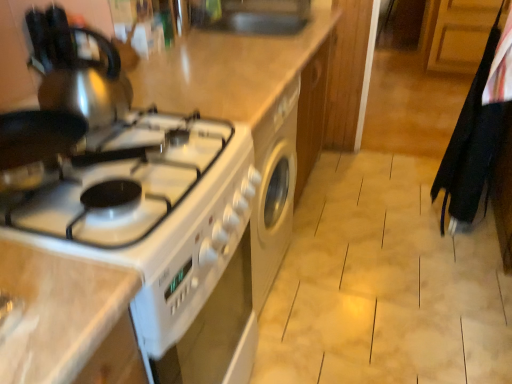
The height and width of the screenshot is (384, 512). What do you see at coordinates (103, 174) in the screenshot?
I see `white glossy gas stove at left` at bounding box center [103, 174].

The width and height of the screenshot is (512, 384). What do you see at coordinates (250, 107) in the screenshot?
I see `white glossy stove at left` at bounding box center [250, 107].

I want to click on white glossy gas stove at left, so click(103, 174).

Is black fabric laundry at right oriented away from white glossy gas stove at left?

No, black fabric laundry at right is not facing the opposite direction of white glossy gas stove at left.

Is black fabric laundry at right behind white glossy gas stove at left?

Yes, black fabric laundry at right is behind white glossy gas stove at left.

From a real-world perspective, which object stands above the other?

white glossy gas stove at left.

Consider the image. Is black fabric laundry at right inside the boundaries of white glossy gas stove at left, or outside?

black fabric laundry at right is not inside white glossy gas stove at left, it's outside.

Considering the positions of point (47, 104) and point (168, 118), is point (47, 104) closer or farther from the camera than point (168, 118)?

Clearly, point (47, 104) is closer to the camera than point (168, 118).

Between satin silver kettle at upper left and white glossy gas stove at left, which one has less height?

white glossy gas stove at left is shorter.

From a real-world perspective, does satin silver kettle at upper left stand above white glossy gas stove at left?

Yes, from a real-world perspective, satin silver kettle at upper left is on top of white glossy gas stove at left.

Which object is thinner, satin silver kettle at upper left or white glossy gas stove at left?

With smaller width is satin silver kettle at upper left.

From the picture: Is there a large distance between white glossy stove at left and white glossy gas stove at left?

No.

Could you tell me if white glossy stove at left is turned towards white glossy gas stove at left?

No, white glossy stove at left is not oriented towards white glossy gas stove at left.

Can you confirm if white glossy stove at left is wider than white glossy gas stove at left?

Yes, white glossy stove at left is wider than white glossy gas stove at left.

From a real-world perspective, is satin silver kettle at upper left located higher than white glossy stove at left?

Yes, from a real-world perspective, satin silver kettle at upper left is on top of white glossy stove at left.

Is satin silver kettle at upper left beside white glossy stove at left?

satin silver kettle at upper left is not next to white glossy stove at left, and they're not touching.

Who is taller, satin silver kettle at upper left or white glossy stove at left?

Standing taller between the two is white glossy stove at left.

Looking at this image, from a real-world perspective, relative to satin silver kettle at upper left, is white glossy gas stove at left vertically above or below?

In terms of real-world spatial position, white glossy gas stove at left is below satin silver kettle at upper left.

This screenshot has width=512, height=384. I want to click on tea pot that appears on the left of white glossy gas stove at left, so click(87, 94).

Does white glossy gas stove at left come in front of satin silver kettle at upper left?

Yes.

Locate an element on the screen. This screenshot has height=384, width=512. kitchen appliance that appears below the satin silver kettle at upper left (from a real-world perspective) is located at coordinates (250, 107).

From the image's perspective, between white glossy stove at left and satin silver kettle at upper left, who is located below?

white glossy stove at left is shown below in the image.

Does white glossy stove at left have a larger size compared to satin silver kettle at upper left?

Yes, white glossy stove at left is bigger than satin silver kettle at upper left.

From a real-world perspective, which is physically below, white glossy stove at left or satin silver kettle at upper left?

In real-world perspective, white glossy stove at left is lower.

Considering the sizes of white glossy stove at left and black fabric laundry at right in the image, is white glossy stove at left taller or shorter than black fabric laundry at right?

In the image, white glossy stove at left appears to be shorter than black fabric laundry at right.

Looking at this image, is white glossy stove at left not within black fabric laundry at right?

white glossy stove at left lies outside black fabric laundry at right's area.

What are the coordinates of `gas stove below the black fabric laundry at right (from the image's perspective)` in the screenshot? It's located at (103, 174).

In order to click on tea pot lying above the white glossy gas stove at left (from the image's perspective) in this screenshot , I will do 87,94.

Which object lies nearer to the anchor point white glossy stove at left, black fabric laundry at right or white glossy gas stove at left?

white glossy gas stove at left is positioned closer to the anchor white glossy stove at left.

When comparing their distances from black fabric laundry at right, does white glossy gas stove at left or satin silver kettle at upper left seem further?

satin silver kettle at upper left is positioned further to the anchor black fabric laundry at right.

Looking at this image, when comparing their distances from white glossy stove at left, does black fabric laundry at right or satin silver kettle at upper left seem further?

Among the two, black fabric laundry at right is located further to white glossy stove at left.

Which object lies further to the anchor point white glossy stove at left, satin silver kettle at upper left or white glossy gas stove at left?

Based on the image, satin silver kettle at upper left appears to be further to white glossy stove at left.

Considering their positions, is white glossy gas stove at left positioned closer to satin silver kettle at upper left than white glossy stove at left?

white glossy gas stove at left lies closer to satin silver kettle at upper left than the other object.

Considering their positions, is white glossy stove at left positioned further to satin silver kettle at upper left than white glossy gas stove at left?

Among the two, white glossy stove at left is located further to satin silver kettle at upper left.

When comparing their distances from satin silver kettle at upper left, does white glossy gas stove at left or black fabric laundry at right seem further?

The object further to satin silver kettle at upper left is black fabric laundry at right.

Looking at the image, which one is located further to black fabric laundry at right, white glossy stove at left or satin silver kettle at upper left?

satin silver kettle at upper left is positioned further to the anchor black fabric laundry at right.

Locate an element on the screen. This screenshot has width=512, height=384. kitchen appliance between satin silver kettle at upper left and black fabric laundry at right in the horizontal direction is located at coordinates (250, 107).

At what (x,y) coordinates should I click in order to perform the action: click on gas stove between satin silver kettle at upper left and black fabric laundry at right. Please return your answer as a coordinate pair (x, y). The width and height of the screenshot is (512, 384). Looking at the image, I should click on (103, 174).

Identify the location of kitchen appliance situated between white glossy gas stove at left and black fabric laundry at right from left to right. (250, 107).

Identify the location of tea pot between white glossy gas stove at left and white glossy stove at left in the front-back direction. Image resolution: width=512 pixels, height=384 pixels. (87, 94).